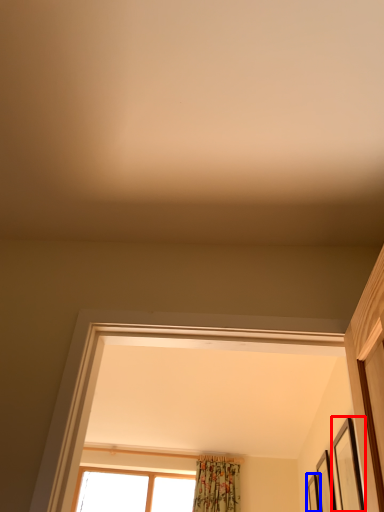
Question: Which of the following is the closest to the observer, picture frame (highlighted by a red box) or picture frame (highlighted by a blue box)?

Choices:
 (A) picture frame
 (B) picture frame

Answer: (A)